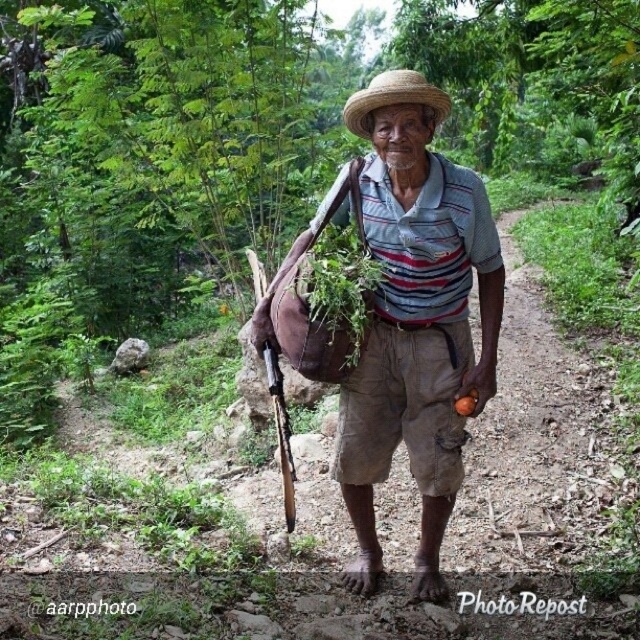
Question: Which point is farther to the camera?

Choices:
 (A) strawmaterial/texturehat at center
 (B) brown woven hat at center

Answer: (A)

Question: Is brown woven hat at center bigger than strawmaterial/texturehat at center?

Choices:
 (A) no
 (B) yes

Answer: (A)

Question: In this image, where is brown woven hat at center located relative to strawmaterial/texturehat at center?

Choices:
 (A) right
 (B) left

Answer: (B)

Question: Is brown woven hat at center to the right of strawmaterial/texturehat at center from the viewer's perspective?

Choices:
 (A) yes
 (B) no

Answer: (B)